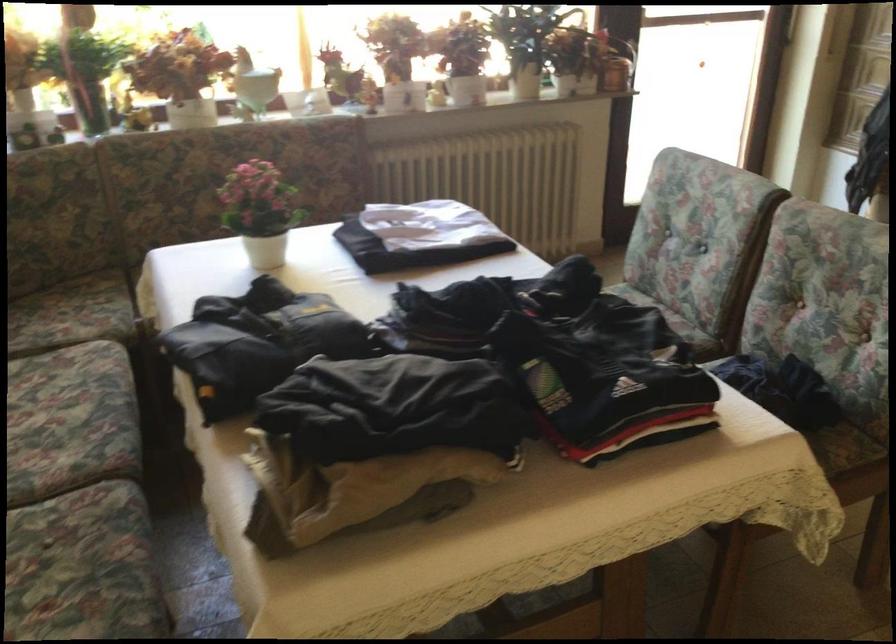
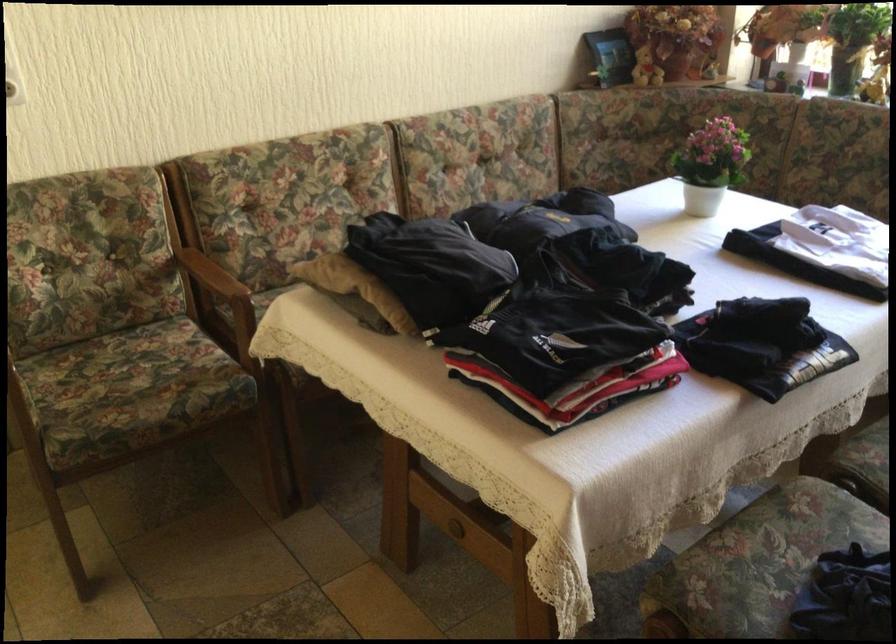
In the second image, find the point that corresponds to point (277, 207) in the first image.

(711, 164)